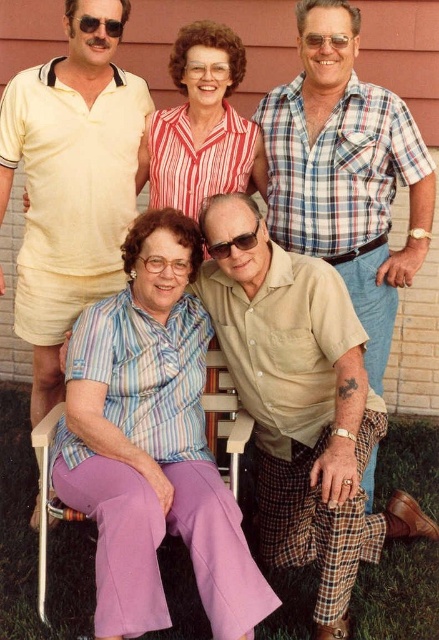
You are a photographer trying to capture a closeup of the beige plaid shorts at lower center. Based on the coordinates provided, where should you position your camera to ensure the shorts are centered in the frame?

The beige plaid shorts at lower center are located at coordinates point (346, 173). To center them in the frame, position your camera so that the center of the lens aligns with these coordinates.

You are standing 3 meters away from the camera. Can you reach the beige plaid shorts at lower center without moving?

The beige plaid shorts at lower center are 2.81 meters away from the camera. Since you are standing 3 meters away from the camera, you are farther than the distance to the shorts, so you cannot reach them without moving closer.